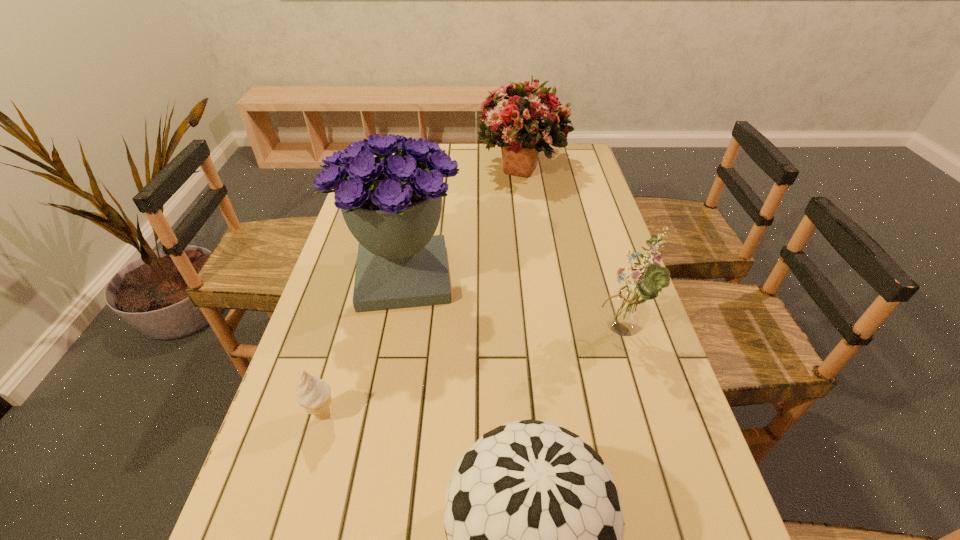
At what (x,y) coordinates should I click in order to perform the action: click on the tallest object. Please return your answer as a coordinate pair (x, y). Looking at the image, I should click on (392, 204).

At what (x,y) coordinates should I click in order to perform the action: click on the tallest bouquet. Please return your answer as a coordinate pair (x, y). The height and width of the screenshot is (540, 960). Looking at the image, I should click on (392, 204).

At what (x,y) coordinates should I click in order to perform the action: click on the farthest object. Please return your answer as a coordinate pair (x, y). The image size is (960, 540). Looking at the image, I should click on (525, 120).

Locate an element on the screen. This screenshot has height=540, width=960. the shortest object is located at coordinates (314, 396).

You are a GUI agent. You are given a task and a screenshot of the screen. Output one action in this format:
    pyautogui.click(x=<x>, y=<y>)
    Task: Click on the icecream
    
    Given the screenshot: What is the action you would take?
    click(x=314, y=396)

Identify the location of vacant region located 0.120m on the back of the leftmost bouquet. (x=416, y=215).

Locate an element on the screen. The height and width of the screenshot is (540, 960). vacant space situated on the left of the farthest object is located at coordinates (390, 167).

Locate an element on the screen. This screenshot has width=960, height=540. free spot located on the front-facing side of the shortest object is located at coordinates (x=476, y=414).

Locate an element on the screen. object that is at the far edge is located at coordinates (525, 120).

Locate an element on the screen. The height and width of the screenshot is (540, 960). bouquet that is at the left edge is located at coordinates coord(392,204).